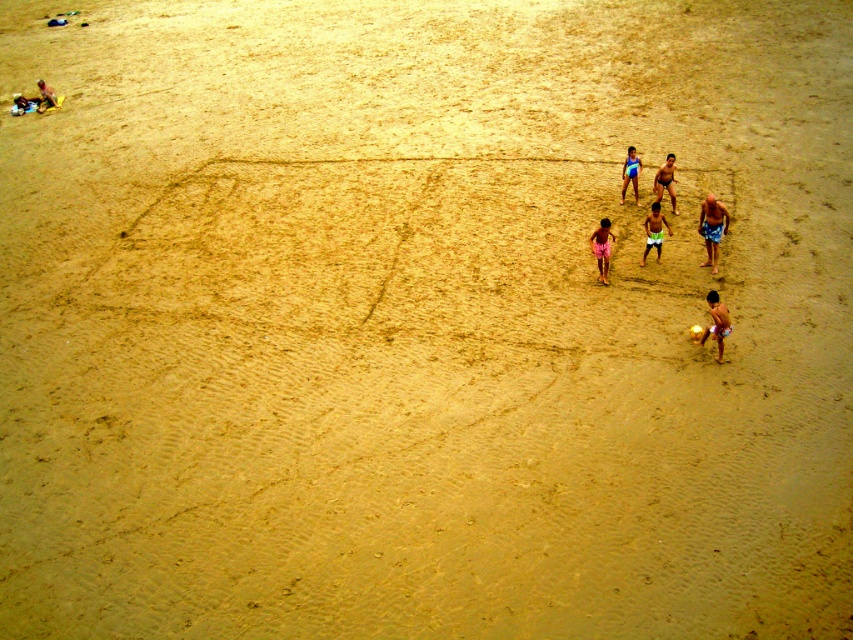
You are standing at the edge of the beach looking towards the sand drawing. You see a tan skin man at center and a beige fabric bag at upper left. Which object is closer to the left side of the scene?

The beige fabric bag at upper left is closer to the left side of the scene because the tan skin man at center is positioned on the right side of it.

You are standing at the beach and see two points marked on the sand. The first point is at position point (660, 173) and the second is at point (44, 100). From your perspective, which point is closer to you?

Point (660, 173) is in front of point (44, 100), so the first point is closer to you.